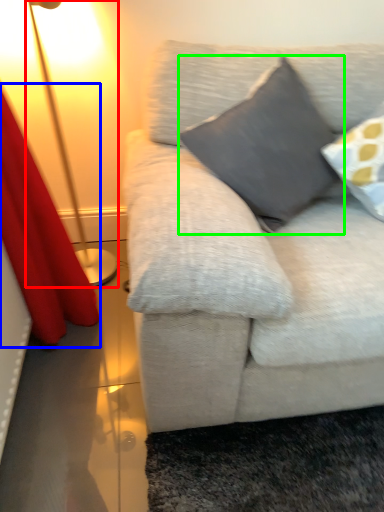
Question: Which object is the farthest from lamp (highlighted by a red box)? Choose among these: curtain (highlighted by a blue box) or pillow (highlighted by a green box).

Choices:
 (A) curtain
 (B) pillow

Answer: (B)